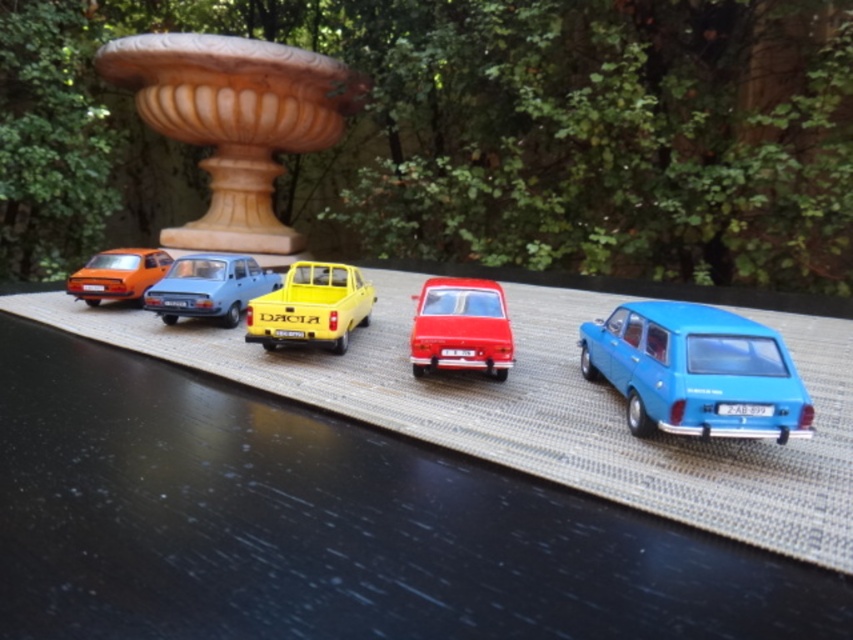
Question: Estimate the real-world distances between objects in this image. Which object is farther from the matte orange car at left?

Choices:
 (A) glossy red sedan at center
 (B) matte blue sedan at center
 (C) yellow matte pickup truck at center

Answer: (A)

Question: Which of the following is the farthest from the observer?

Choices:
 (A) (682, 342)
 (B) (331, 333)

Answer: (B)

Question: Is glossy red sedan at center above matte orange car at left?

Choices:
 (A) no
 (B) yes

Answer: (A)

Question: Is glossy red sedan at center positioned before matte blue sedan at center?

Choices:
 (A) no
 (B) yes

Answer: (B)

Question: Which point appears closest to the camera in this image?

Choices:
 (A) (154, 298)
 (B) (364, 314)
 (C) (120, 280)

Answer: (A)

Question: Can you confirm if blue matte station wagon at right is positioned below yellow matte pickup truck at center?

Choices:
 (A) yes
 (B) no

Answer: (A)